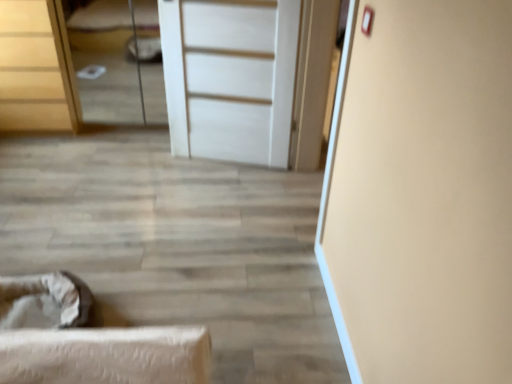
Question: Is white matte door at center positioned with its back to wooden chest of drawers at upper left?

Choices:
 (A) yes
 (B) no

Answer: (B)

Question: Does white matte door at center appear on the right side of wooden chest of drawers at upper left?

Choices:
 (A) yes
 (B) no

Answer: (A)

Question: Considering the relative sizes of white matte door at center and wooden chest of drawers at upper left in the image provided, is white matte door at center bigger than wooden chest of drawers at upper left?

Choices:
 (A) no
 (B) yes

Answer: (A)

Question: Is white matte door at center next to wooden chest of drawers at upper left and touching it?

Choices:
 (A) no
 (B) yes

Answer: (A)

Question: Does white matte door at center come behind wooden chest of drawers at upper left?

Choices:
 (A) yes
 (B) no

Answer: (B)

Question: Considering the positions of matte white bed at upper left and wooden chest of drawers at upper left in the image, is matte white bed at upper left wider or thinner than wooden chest of drawers at upper left?

Choices:
 (A) thin
 (B) wide

Answer: (A)

Question: Considering the relative positions of matte white bed at upper left and wooden chest of drawers at upper left in the image provided, is matte white bed at upper left to the left or to the right of wooden chest of drawers at upper left?

Choices:
 (A) right
 (B) left

Answer: (A)

Question: From a real-world perspective, is matte white bed at upper left physically located above or below wooden chest of drawers at upper left?

Choices:
 (A) below
 (B) above

Answer: (A)

Question: Do you think matte white bed at upper left is within wooden chest of drawers at upper left, or outside of it?

Choices:
 (A) outside
 (B) inside

Answer: (A)

Question: Looking at their shapes, would you say white matte door at center is wider or thinner than wooden chest of drawers at upper left?

Choices:
 (A) thin
 (B) wide

Answer: (A)

Question: From their relative heights in the image, would you say white matte door at center is taller or shorter than wooden chest of drawers at upper left?

Choices:
 (A) short
 (B) tall

Answer: (B)

Question: Does point (x=293, y=66) appear closer or farther from the camera than point (x=42, y=59)?

Choices:
 (A) closer
 (B) farther

Answer: (A)

Question: From a real-world perspective, is white matte door at center above or below wooden chest of drawers at upper left?

Choices:
 (A) below
 (B) above

Answer: (B)

Question: From a real-world perspective, is white matte door at center positioned above or below matte white bed at upper left?

Choices:
 (A) below
 (B) above

Answer: (B)

Question: Choose the correct answer: Is white matte door at center inside matte white bed at upper left or outside it?

Choices:
 (A) outside
 (B) inside

Answer: (A)